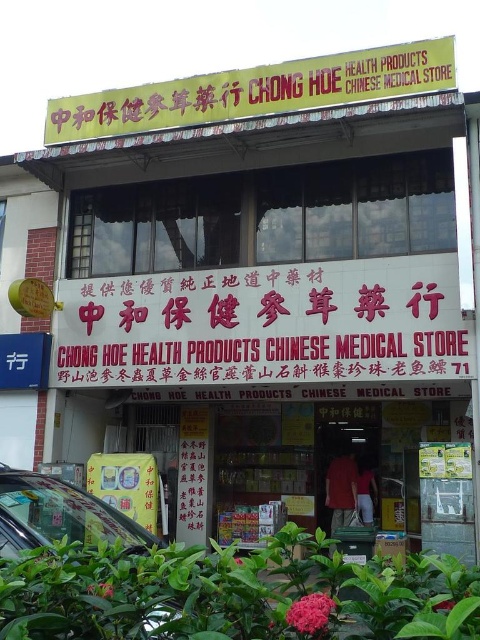
Question: Which point is closer to the camera?

Choices:
 (A) (141, 528)
 (B) (93, 282)
 (C) (354, 413)

Answer: (A)

Question: Which point is farther from the camera taking this photo?

Choices:
 (A) (206, 321)
 (B) (108, 97)
 (C) (237, 410)

Answer: (C)

Question: Can you confirm if yellow matte signboard at upper center is positioned to the left of metallic silver car at lower left?

Choices:
 (A) yes
 (B) no

Answer: (B)

Question: From the image, what is the correct spatial relationship of yellow cardboard sign at center in relation to yellow matte signboard at upper center?

Choices:
 (A) below
 (B) above

Answer: (A)

Question: Can you confirm if yellow cardboard sign at center is positioned to the right of yellow matte signboard at upper center?

Choices:
 (A) no
 (B) yes

Answer: (B)

Question: Which object is positioned farthest from the pink paper sign at center?

Choices:
 (A) yellow cardboard sign at center
 (B) metallic silver car at lower left
 (C) yellow matte signboard at upper center

Answer: (B)